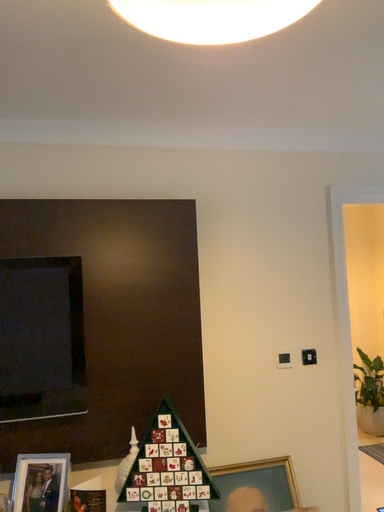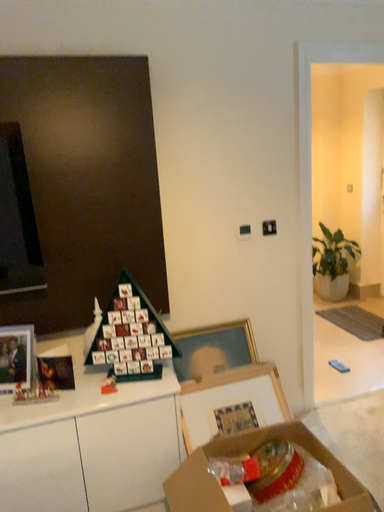
Question: How did the camera likely rotate when shooting the video?

Choices:
 (A) rotated downward
 (B) rotated upward

Answer: (A)